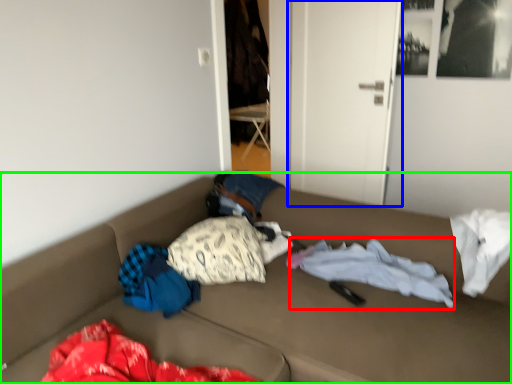
Question: Which is nearer to the blanket (highlighted by a red box)? door (highlighted by a blue box) or furniture (highlighted by a green box).

Choices:
 (A) door
 (B) furniture

Answer: (B)